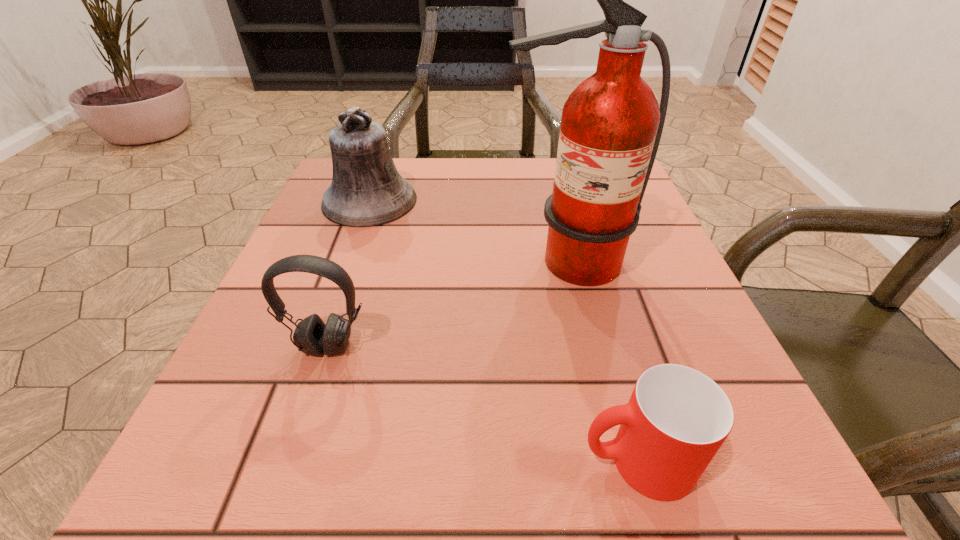
The height and width of the screenshot is (540, 960). I want to click on free area in between the headset and the shortest object, so click(x=483, y=403).

I want to click on vacant point located between the headset and the cup, so click(483, 403).

Where is `empty location between the third farthest object and the third shortest object`? The height and width of the screenshot is (540, 960). empty location between the third farthest object and the third shortest object is located at coordinates (348, 273).

Where is `free area in between the headset and the cup`? free area in between the headset and the cup is located at coordinates click(483, 403).

The image size is (960, 540). I want to click on free space between the cup and the second farthest object, so click(x=601, y=361).

Locate an element on the screen. free point between the second shortest object and the third shortest object is located at coordinates (348, 273).

At what (x,y) coordinates should I click in order to perform the action: click on object that is the second closest to the second nearest object. Please return your answer as a coordinate pair (x, y). The height and width of the screenshot is (540, 960). Looking at the image, I should click on (366, 190).

Identify which object is the nearest to the third farthest object. Please provide its 2D coordinates. Your answer should be formatted as a tuple, i.e. [(x, y)], where the tuple contains the x and y coordinates of a point satisfying the conditions above.

[(611, 125)]

Locate an element on the screen. Image resolution: width=960 pixels, height=540 pixels. vacant region that satisfies the following two spatial constraints: 1. on the side of the shortest object with the handle; 2. on the nozzle and handle of the second farthest object is located at coordinates (582, 262).

This screenshot has height=540, width=960. In order to click on vacant space that satisfies the following two spatial constraints: 1. on the side of the nearest object with the handle; 2. on the nozzle and handle of the third nearest object in this screenshot , I will do `click(582, 262)`.